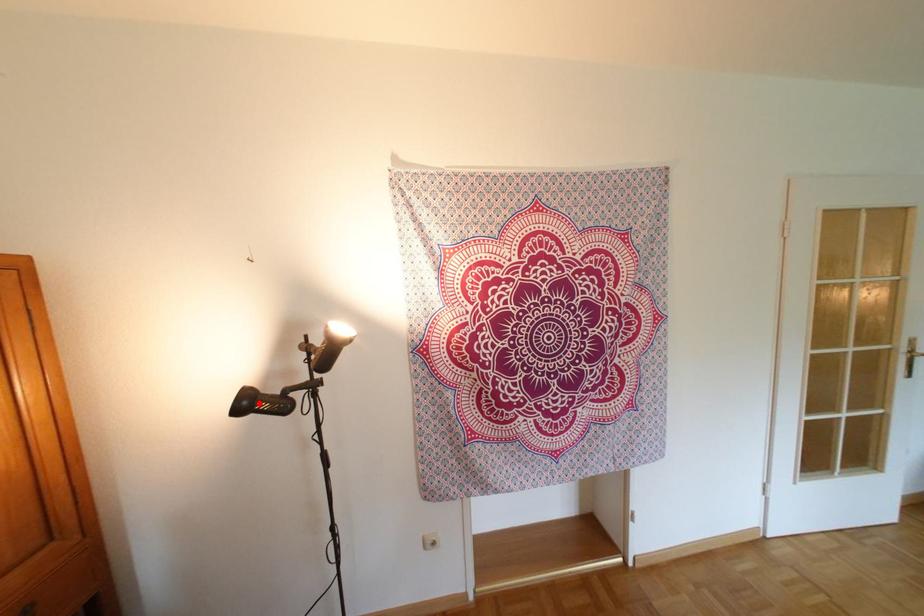
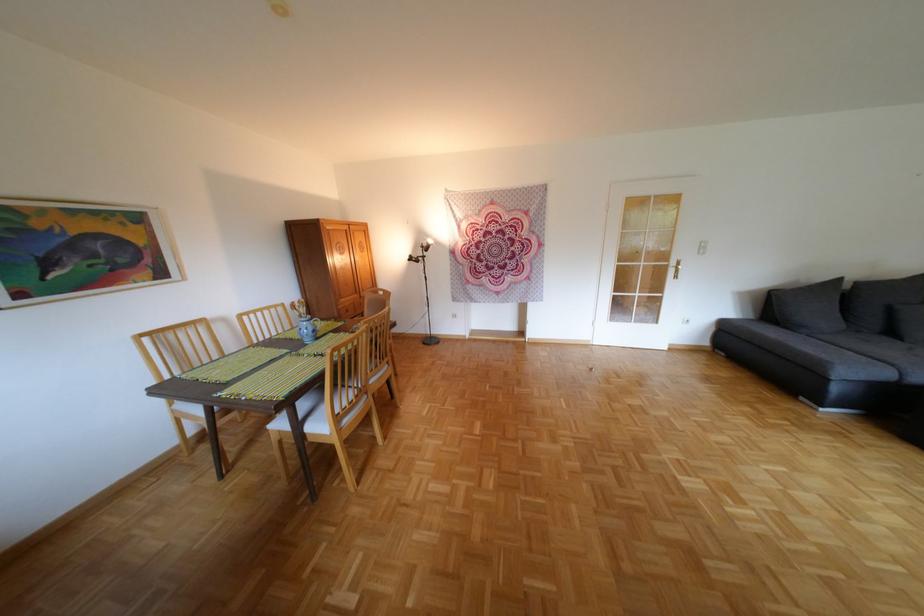
Question: I am providing you with two images of the same scene from different viewpoints. A red point is shown in image1. For the corresponding object point in image2, is it positioned nearer or farther from the camera?

Choices:
 (A) Nearer
 (B) Farther

Answer: (A)